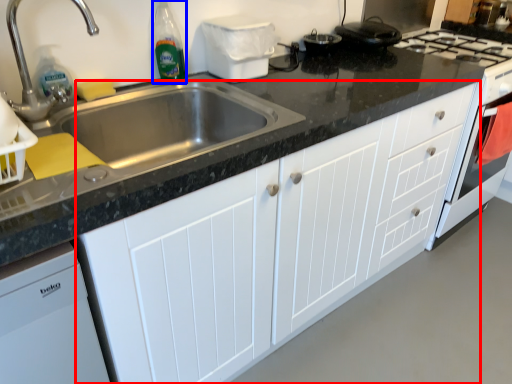
Question: Which point is closer to the camera, cabinetry (highlighted by a red box) or bottle (highlighted by a blue box)?

Choices:
 (A) cabinetry
 (B) bottle

Answer: (A)